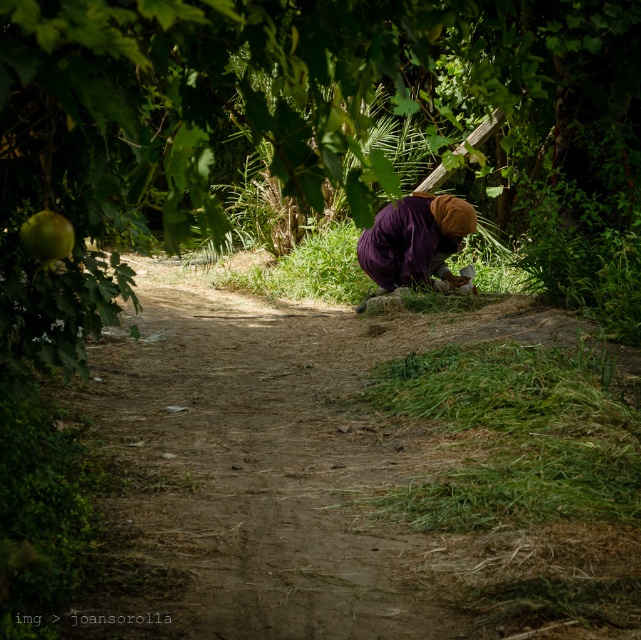
Who is positioned more to the left, green leafy tree at center or green matte apple at upper left?

green matte apple at upper left is more to the left.

Between green leafy tree at center and green matte apple at upper left, which one has more height?

With more height is green leafy tree at center.

Where is `green leafy tree at center`? The image size is (641, 640). green leafy tree at center is located at coordinates (312, 134).

The image size is (641, 640). Find the location of `green leafy tree at center`. green leafy tree at center is located at coordinates (312, 134).

What do you see at coordinates (312, 134) in the screenshot? This screenshot has width=641, height=640. I see `green leafy tree at center` at bounding box center [312, 134].

Is green leafy tree at center to the right of purple fabric at center from the viewer's perspective?

In fact, green leafy tree at center is to the left of purple fabric at center.

The height and width of the screenshot is (640, 641). Describe the element at coordinates (312, 134) in the screenshot. I see `green leafy tree at center` at that location.

Identify the location of green leafy tree at center. This screenshot has width=641, height=640. (312, 134).

Is the position of purple fabric at center more distant than that of green matte apple at upper left?

Yes, it is behind green matte apple at upper left.

Is purple fabric at center below green matte apple at upper left?

Incorrect, purple fabric at center is not positioned below green matte apple at upper left.

Locate an element on the screen. The width and height of the screenshot is (641, 640). purple fabric at center is located at coordinates (415, 240).